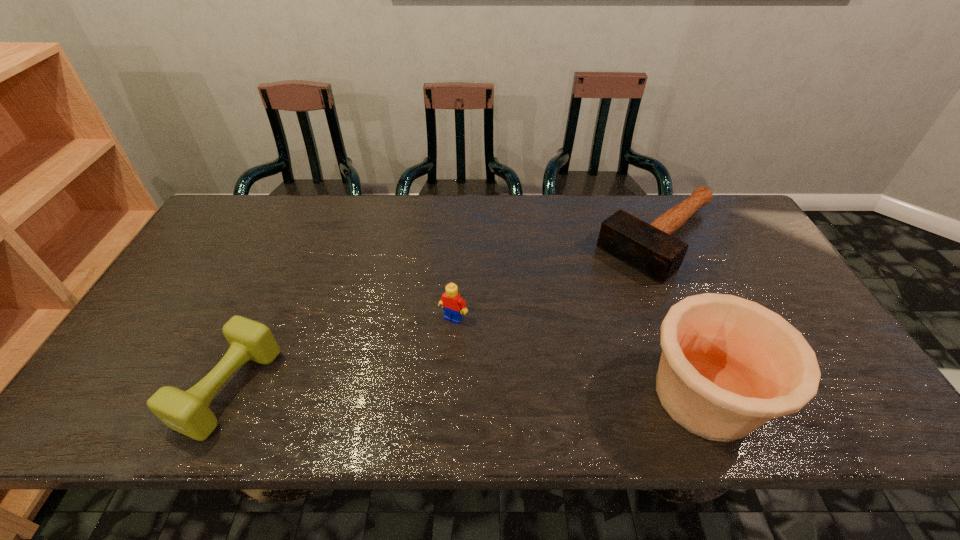
This screenshot has width=960, height=540. Find the location of `object that ranks as the closest to the Lego`. object that ranks as the closest to the Lego is located at coordinates (187, 412).

Find the location of a particular element. Image resolution: width=960 pixels, height=540 pixels. vacant space that satisfies the following two spatial constraints: 1. on the front side of the pottery; 2. on the left side of the third nearest object is located at coordinates (449, 396).

The image size is (960, 540). Identify the location of vacant space that satisfies the following two spatial constraints: 1. on the front side of the second object from left to right; 2. on the left side of the pottery. (449, 396).